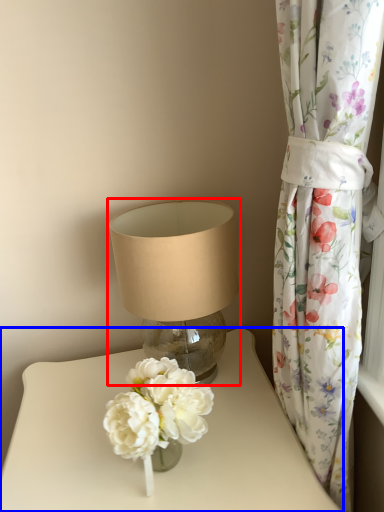
Question: Which object is further to the camera taking this photo, lamp (highlighted by a red box) or table (highlighted by a blue box)?

Choices:
 (A) lamp
 (B) table

Answer: (A)